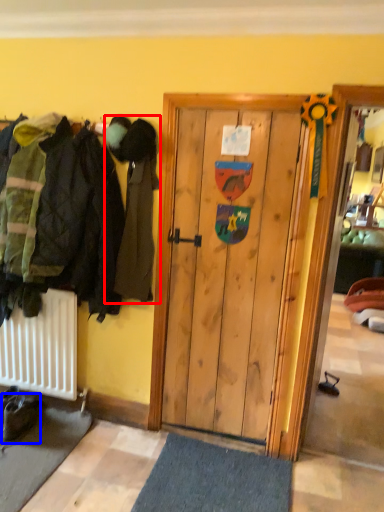
Question: Among these objects, which one is nearest to the camera, person (highlighted by a red box) or footwear (highlighted by a blue box)?

Choices:
 (A) person
 (B) footwear

Answer: (A)